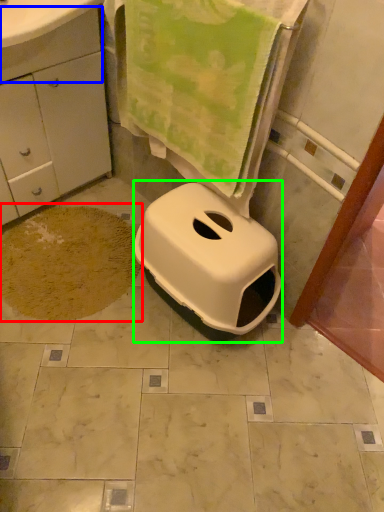
Question: Which object is the closest to the dirt (highlighted by a red box)? Choose among these: drawer (highlighted by a blue box) or bidet (highlighted by a green box).

Choices:
 (A) drawer
 (B) bidet

Answer: (B)